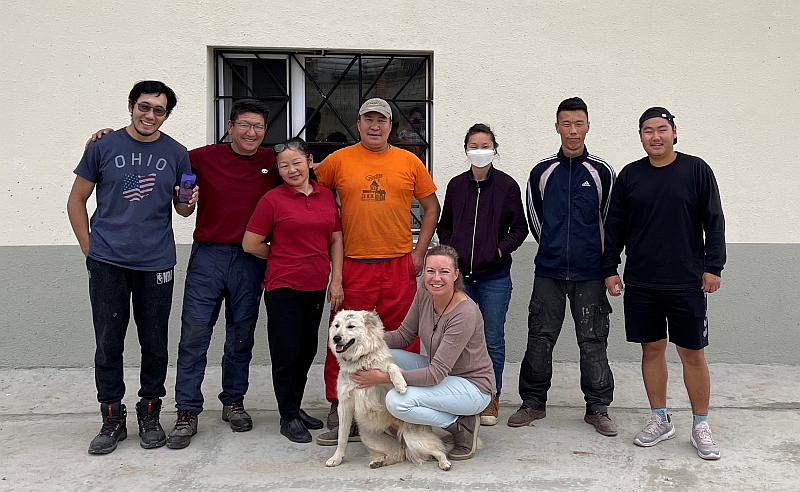
The width and height of the screenshot is (800, 492). In order to click on window trim in this screenshot , I will do `click(297, 104)`.